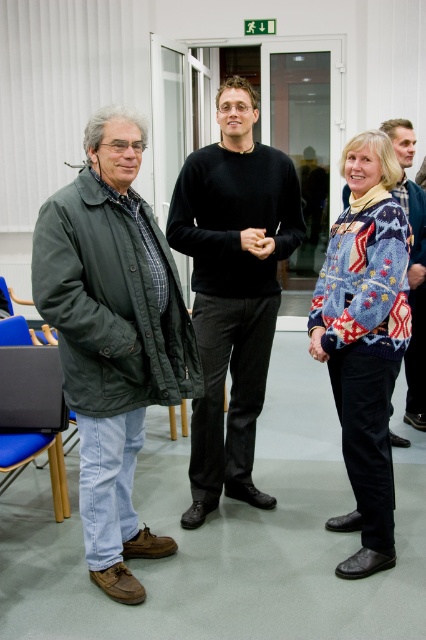
Can you confirm if black smooth sweater at center is positioned to the left of knitted sweater at center?

Yes, black smooth sweater at center is to the left of knitted sweater at center.

Does black smooth sweater at center appear under knitted sweater at center?

Indeed, black smooth sweater at center is positioned under knitted sweater at center.

The image size is (426, 640). What do you see at coordinates (233, 289) in the screenshot? I see `black smooth sweater at center` at bounding box center [233, 289].

Identify the location of black smooth sweater at center. The height and width of the screenshot is (640, 426). (233, 289).

Is black smooth sweater at center in front of blue knitted sweater at center?

That is False.

Is point (186, 253) more distant than point (360, 454)?

Yes, point (186, 253) is behind point (360, 454).

Is point (218, 248) positioned in front of point (402, 337)?

That is False.

The width and height of the screenshot is (426, 640). In order to click on black smooth sweater at center in this screenshot , I will do `click(233, 289)`.

Does green canvas jacket at left have a greater height compared to black smooth sweater at center?

No.

Can you confirm if green canvas jacket at left is bigger than black smooth sweater at center?

No, green canvas jacket at left is not bigger than black smooth sweater at center.

Does point (140, 356) come farther from viewer compared to point (189, 198)?

No, (140, 356) is in front of (189, 198).

At what (x,y) coordinates should I click in order to perform the action: click on green canvas jacket at left. Please return your answer as a coordinate pair (x, y). Image resolution: width=426 pixels, height=640 pixels. Looking at the image, I should click on (112, 336).